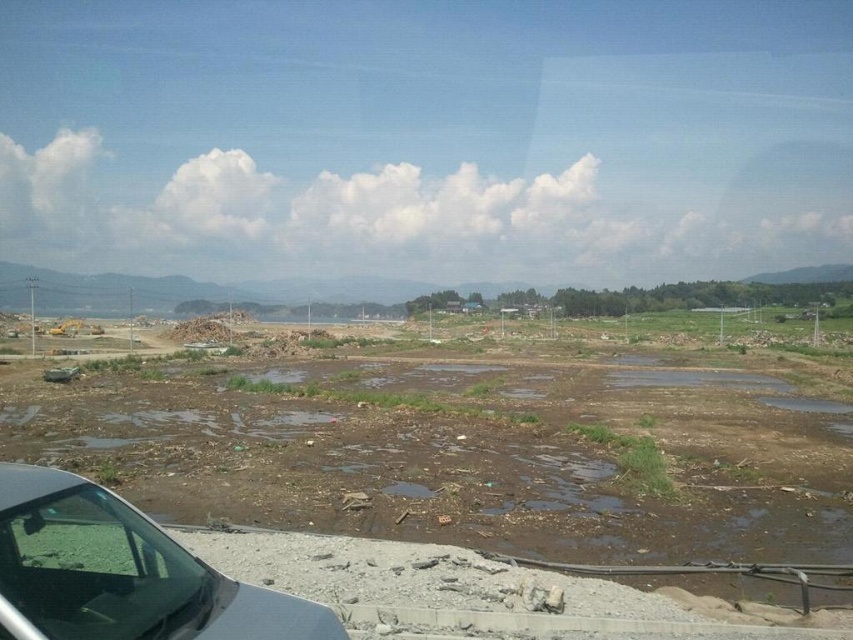
Question: Is brown/dry soil at center closer to camera compared to transparent glass car window at lower left?

Choices:
 (A) yes
 (B) no

Answer: (B)

Question: Considering the relative positions of brown/dry soil at center and transparent glass car window at lower left in the image provided, where is brown/dry soil at center located with respect to transparent glass car window at lower left?

Choices:
 (A) below
 (B) above

Answer: (A)

Question: Which point is closer to the camera?

Choices:
 (A) (379, 464)
 (B) (39, 506)

Answer: (B)

Question: Does brown/dry soil at center have a smaller size compared to transparent glass car window at lower left?

Choices:
 (A) yes
 (B) no

Answer: (B)